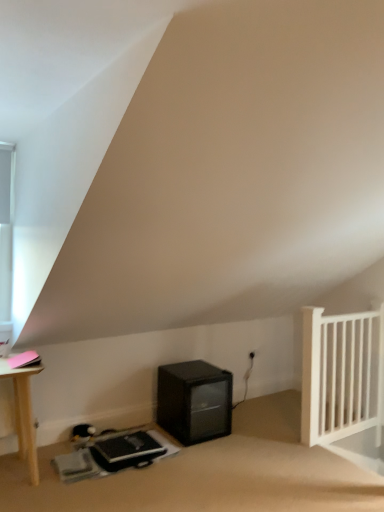
Question: Does white wooden radiator at right touch black matte mini-fridge at lower center?

Choices:
 (A) no
 (B) yes

Answer: (A)

Question: From the image's perspective, is white wooden radiator at right over black matte mini-fridge at lower center?

Choices:
 (A) yes
 (B) no

Answer: (A)

Question: Does white wooden radiator at right have a larger size compared to black matte mini-fridge at lower center?

Choices:
 (A) no
 (B) yes

Answer: (B)

Question: Can black matte mini-fridge at lower center be found inside white wooden radiator at right?

Choices:
 (A) no
 (B) yes

Answer: (A)

Question: Is white wooden radiator at right positioned in front of black matte mini-fridge at lower center?

Choices:
 (A) yes
 (B) no

Answer: (B)

Question: In terms of height, does black matte mini-fridge at lower center look taller or shorter compared to white glass window at upper left?

Choices:
 (A) tall
 (B) short

Answer: (B)

Question: Based on their positions, is black matte mini-fridge at lower center located to the left or right of white glass window at upper left?

Choices:
 (A) left
 (B) right

Answer: (B)

Question: In terms of size, does black matte mini-fridge at lower center appear bigger or smaller than white glass window at upper left?

Choices:
 (A) small
 (B) big

Answer: (B)

Question: Does point (192, 386) appear closer or farther from the camera than point (6, 222)?

Choices:
 (A) closer
 (B) farther

Answer: (B)

Question: Is white glass window at upper left in front of or behind black matte mini-fridge at lower center in the image?

Choices:
 (A) front
 (B) behind

Answer: (A)

Question: Do you think white glass window at upper left is within black matte mini-fridge at lower center, or outside of it?

Choices:
 (A) inside
 (B) outside

Answer: (B)

Question: Considering the positions of white glass window at upper left and black matte mini-fridge at lower center in the image, is white glass window at upper left taller or shorter than black matte mini-fridge at lower center?

Choices:
 (A) tall
 (B) short

Answer: (A)

Question: Is point (8, 224) closer or farther from the camera than point (221, 420)?

Choices:
 (A) farther
 (B) closer

Answer: (B)

Question: Considering the positions of point (193, 370) and point (357, 367), is point (193, 370) closer or farther from the camera than point (357, 367)?

Choices:
 (A) closer
 (B) farther

Answer: (B)

Question: From the image's perspective, is black matte mini-fridge at lower center located above or below white wooden radiator at right?

Choices:
 (A) below
 (B) above

Answer: (A)